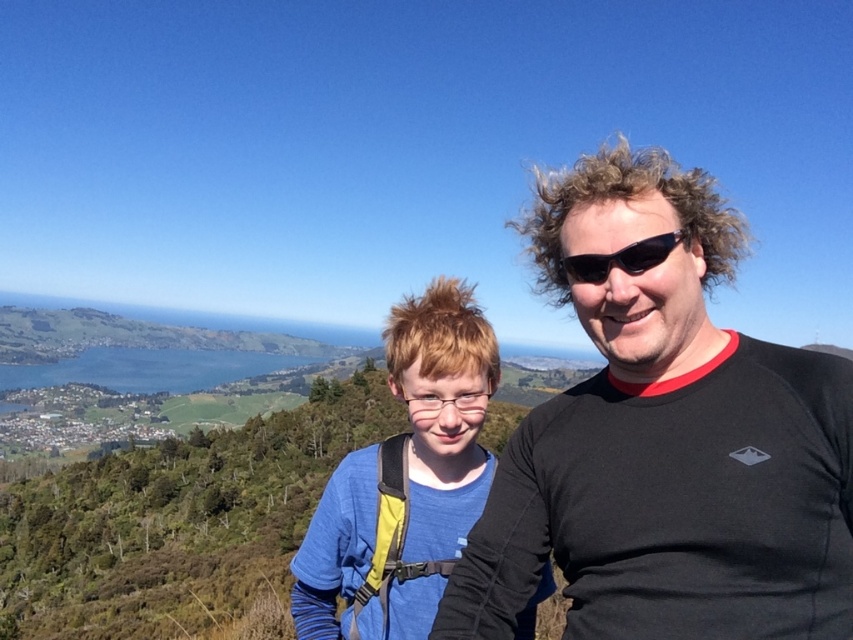
You are a photographer trying to capture a clear shot of both the black matte shirt at right and the black plastic sunglasses at center. Which object should you focus on first to ensure both are in focus?

You should focus on the black matte shirt at right first because it is closer to the viewer than the black plastic sunglasses at center. By focusing on the closer object, the depth of field may also keep the sunglasses in focus.